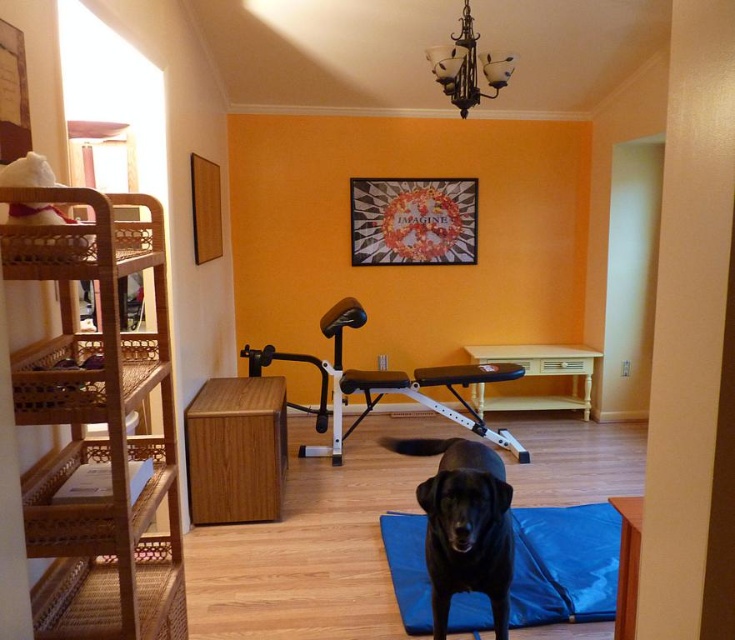
Does woven wood bunk bed at left come in front of black matte dog at center?

Yes, woven wood bunk bed at left is closer to the viewer.

Does point (49, 518) come in front of point (495, 486)?

Yes, point (49, 518) is in front of point (495, 486).

Image resolution: width=735 pixels, height=640 pixels. Describe the element at coordinates (96, 422) in the screenshot. I see `woven wood bunk bed at left` at that location.

The height and width of the screenshot is (640, 735). In order to click on woven wood bunk bed at left in this screenshot , I will do `click(96, 422)`.

Does blue fabric yoga mat at center have a lesser width compared to wooden bunk bed at center?

Correct, blue fabric yoga mat at center's width is less than wooden bunk bed at center's.

Is blue fabric yoga mat at center shorter than wooden bunk bed at center?

Indeed, blue fabric yoga mat at center has a lesser height compared to wooden bunk bed at center.

Locate an element on the screen. This screenshot has width=735, height=640. blue fabric yoga mat at center is located at coordinates (564, 564).

Where is `blue fabric yoga mat at center`? blue fabric yoga mat at center is located at coordinates (564, 564).

Which is more to the left, woven wood bunk bed at left or wooden bunk bed at center?

Positioned to the left is woven wood bunk bed at left.

From the picture: Does woven wood bunk bed at left have a lesser width compared to wooden bunk bed at center?

Yes, woven wood bunk bed at left is thinner than wooden bunk bed at center.

Who is more forward, (118, 632) or (492, 433)?

Positioned in front is point (118, 632).

This screenshot has height=640, width=735. Find the location of `woven wood bunk bed at left`. woven wood bunk bed at left is located at coordinates (96, 422).